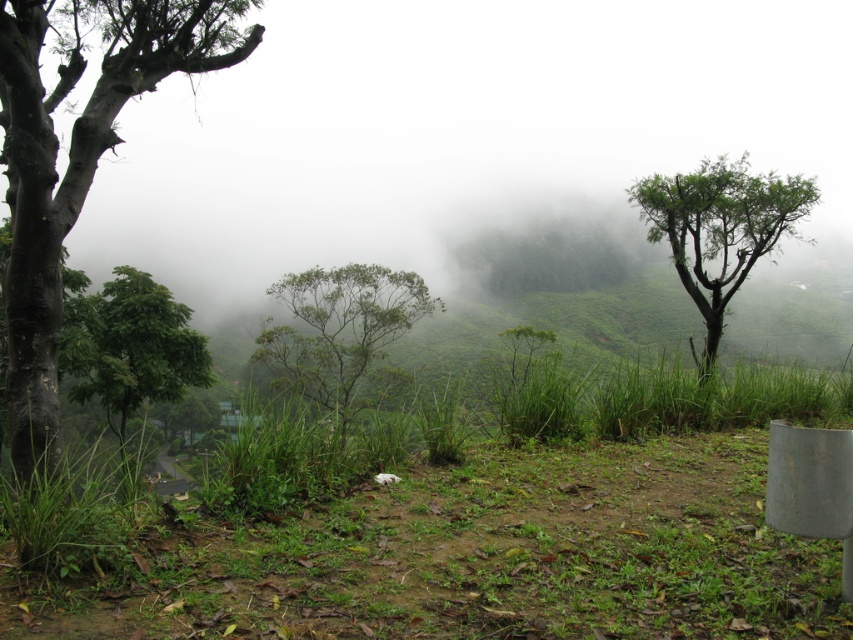
Question: Among these objects, which one is farthest from the camera?

Choices:
 (A) dark brown bark tree at left
 (B) green leafy tree at center
 (C) green leafy tree at lower left
 (D) green leafy tree at right

Answer: (C)

Question: Which point is farther to the camera?

Choices:
 (A) (311, 289)
 (B) (18, 276)

Answer: (A)

Question: Where is dark brown bark tree at left located in relation to green leafy tree at lower left in the image?

Choices:
 (A) right
 (B) left

Answer: (A)

Question: Can you confirm if green leafy tree at right is positioned to the left of green leafy tree at lower left?

Choices:
 (A) no
 (B) yes

Answer: (A)

Question: Estimate the real-world distances between objects in this image. Which object is closer to the green leafy tree at lower left?

Choices:
 (A) dark brown bark tree at left
 (B) green leafy tree at center

Answer: (B)

Question: Considering the relative positions of dark brown bark tree at left and green leafy tree at lower left in the image provided, where is dark brown bark tree at left located with respect to green leafy tree at lower left?

Choices:
 (A) left
 (B) right

Answer: (B)